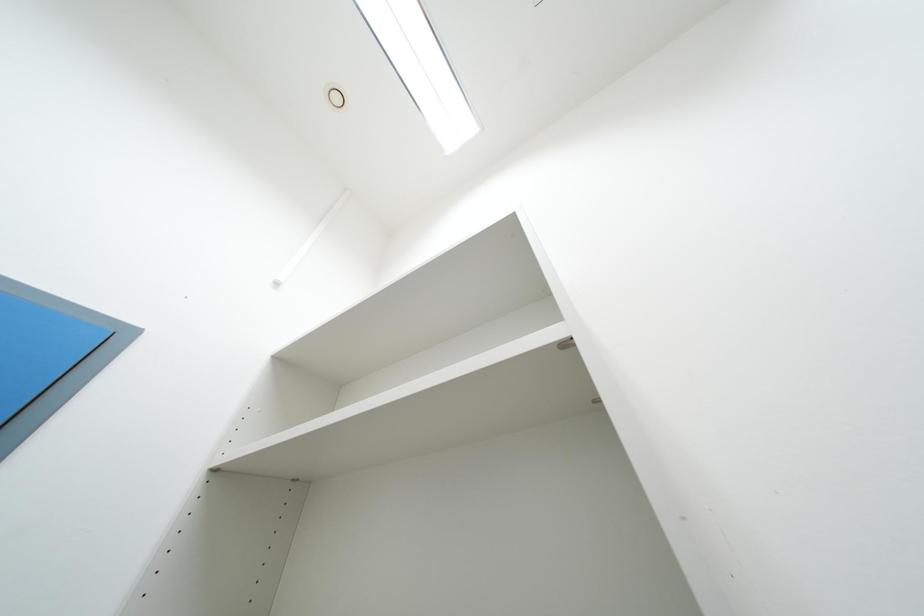
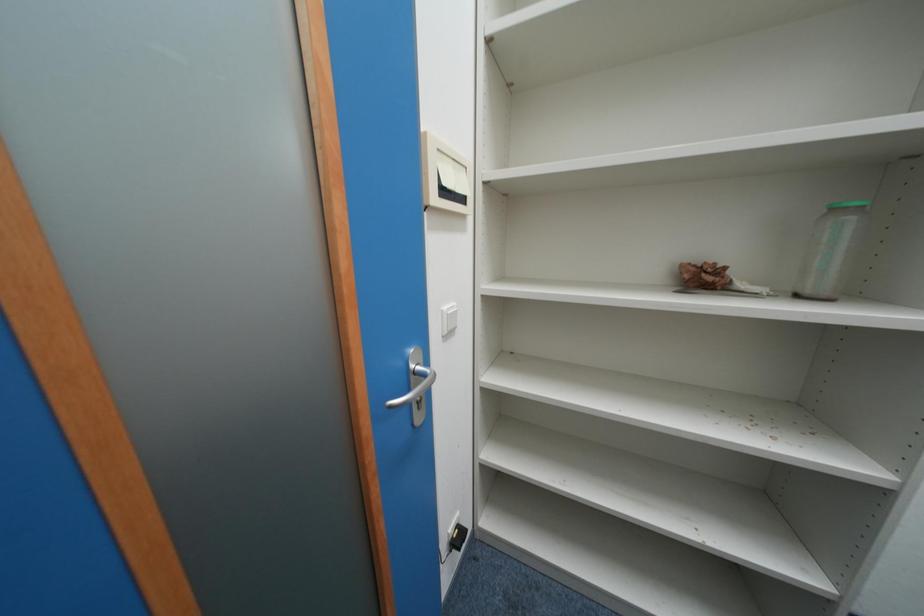
Question: How did the camera likely rotate?

Choices:
 (A) Left
 (B) Right
 (C) Up
 (D) Down

Answer: (D)